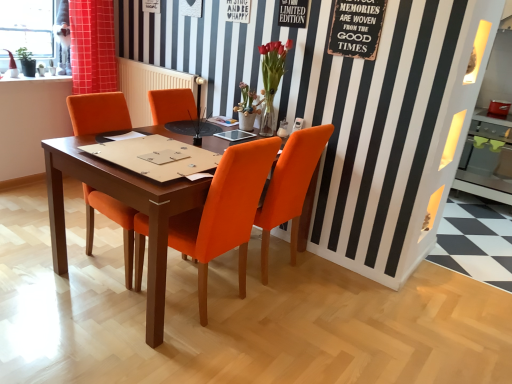
Question: Which direction should I rotate to look at orange fabric chair at center, the first chair from the right?

Choices:
 (A) right
 (B) left

Answer: (A)

Question: Is matte orange vase at center, which ranks as the first flower in left-to-right order, touching matte glass vase at upper center, the second flower from the left?

Choices:
 (A) yes
 (B) no

Answer: (B)

Question: Does matte orange vase at center, which ranks as the first flower in left-to-right order, come behind matte glass vase at upper center, which is counted as the 1th flower, starting from the right?

Choices:
 (A) yes
 (B) no

Answer: (A)

Question: Is matte orange vase at center, which ranks as the first flower in left-to-right order, surrounding matte glass vase at upper center, which is counted as the 1th flower, starting from the right?

Choices:
 (A) yes
 (B) no

Answer: (B)

Question: From a real-world perspective, is matte orange vase at center, which appears as the 2th flower when viewed from the right, beneath matte glass vase at upper center, which is counted as the 1th flower, starting from the right?

Choices:
 (A) no
 (B) yes

Answer: (B)

Question: From the image's perspective, is matte orange vase at center, which appears as the 2th flower when viewed from the right, beneath matte glass vase at upper center, which is counted as the 1th flower, starting from the right?

Choices:
 (A) yes
 (B) no

Answer: (A)

Question: Is matte orange vase at center, which appears as the 2th flower when viewed from the right, shorter than matte glass vase at upper center, which is counted as the 1th flower, starting from the right?

Choices:
 (A) yes
 (B) no

Answer: (A)

Question: Is orange fabric chair at center, the third chair in the left-to-right sequence, next to rustic wood signboard at upper right and touching it?

Choices:
 (A) no
 (B) yes

Answer: (A)

Question: Is orange fabric chair at center, the first chair from the right, taller than rustic wood signboard at upper right?

Choices:
 (A) no
 (B) yes

Answer: (B)

Question: Does orange fabric chair at center, the first chair from the right, have a smaller size compared to rustic wood signboard at upper right?

Choices:
 (A) no
 (B) yes

Answer: (A)

Question: Is there a large distance between orange fabric chair at center, the first chair from the right, and rustic wood signboard at upper right?

Choices:
 (A) no
 (B) yes

Answer: (A)

Question: Does orange fabric chair at center, the first chair from the right, have a lesser height compared to rustic wood signboard at upper right?

Choices:
 (A) no
 (B) yes

Answer: (A)

Question: From the image's perspective, is orange fabric chair at center, the first chair from the right, below rustic wood signboard at upper right?

Choices:
 (A) yes
 (B) no

Answer: (A)

Question: From the image's perspective, is rustic wood signboard at upper right under matte orange vase at center, which appears as the 2th flower when viewed from the right?

Choices:
 (A) yes
 (B) no

Answer: (B)